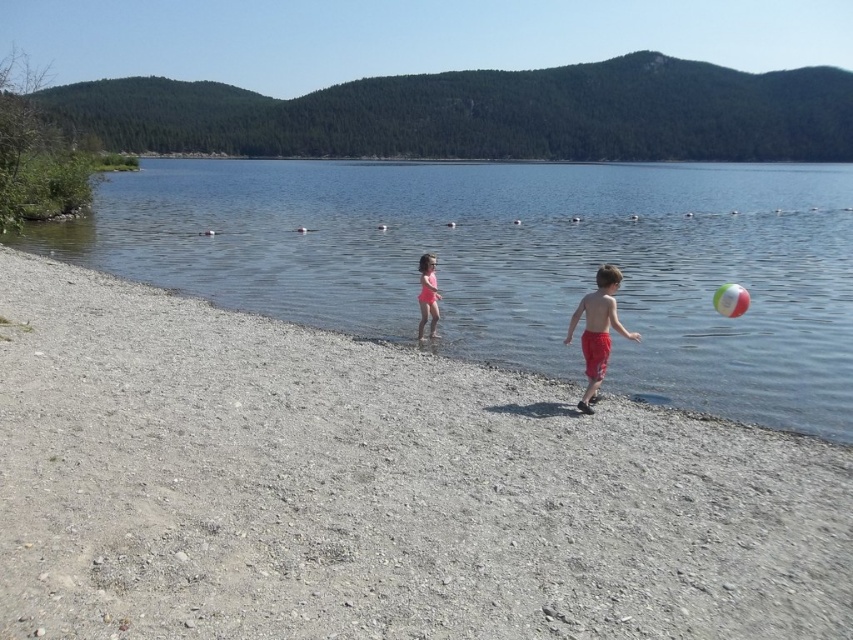
Question: Can you confirm if red cotton shorts at center is thinner than pink matte swimsuit at center?

Choices:
 (A) yes
 (B) no

Answer: (B)

Question: Which object is the farthest from the red cotton shorts at center?

Choices:
 (A) multicolored rubber ball at right
 (B) gray gravelly sand at center

Answer: (B)

Question: Which point is farther from the camera taking this photo?

Choices:
 (A) (434, 292)
 (B) (314, 296)
 (C) (724, 296)

Answer: (B)

Question: Where is clear water at center located in relation to red cotton shorts at center in the image?

Choices:
 (A) below
 (B) above

Answer: (B)

Question: Which object appears closest to the camera in this image?

Choices:
 (A) clear water at center
 (B) pink matte swimsuit at center

Answer: (A)

Question: Does pink matte swimsuit at center have a larger size compared to multicolored rubber ball at right?

Choices:
 (A) no
 (B) yes

Answer: (A)